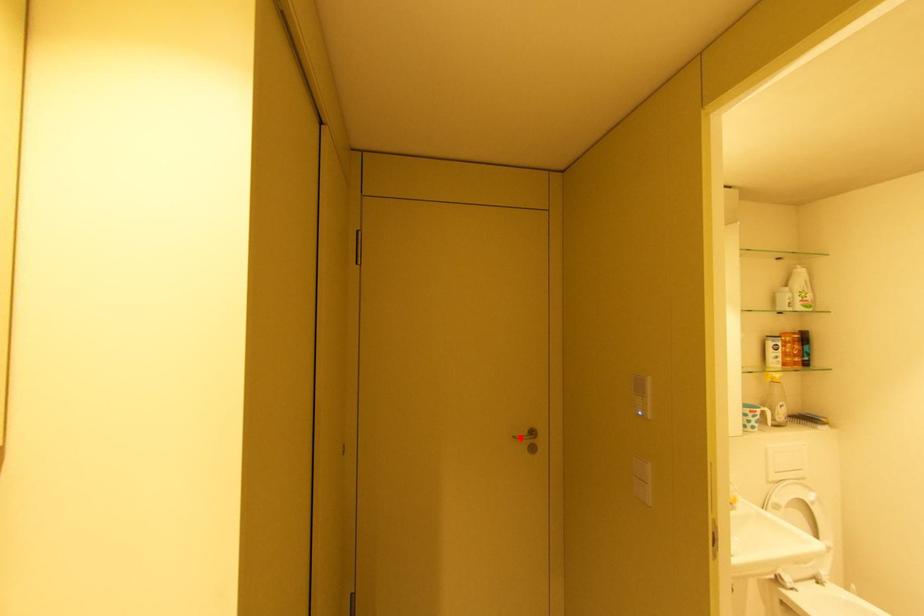
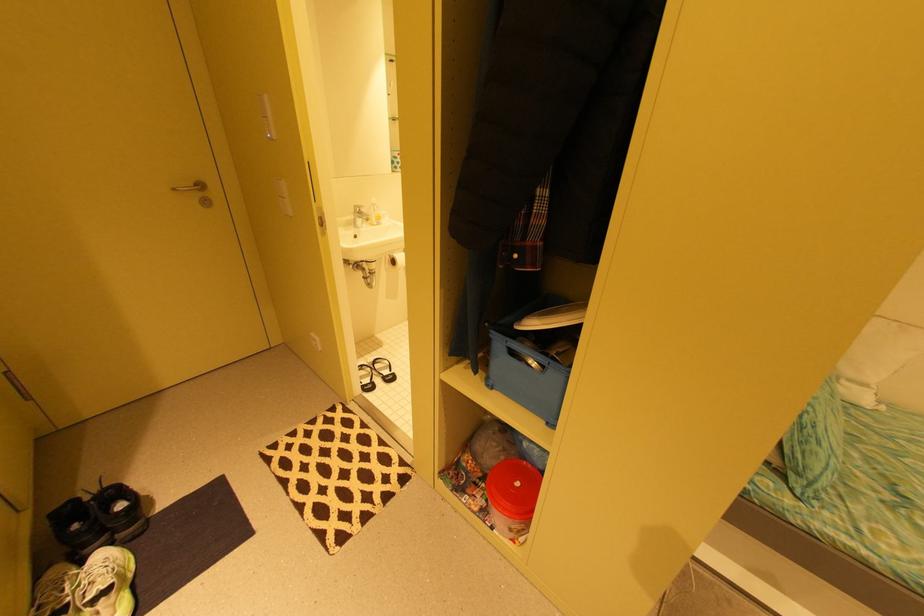
The point at the highlighted location is marked in the first image. Where is the corresponding point in the second image?

(179, 190)